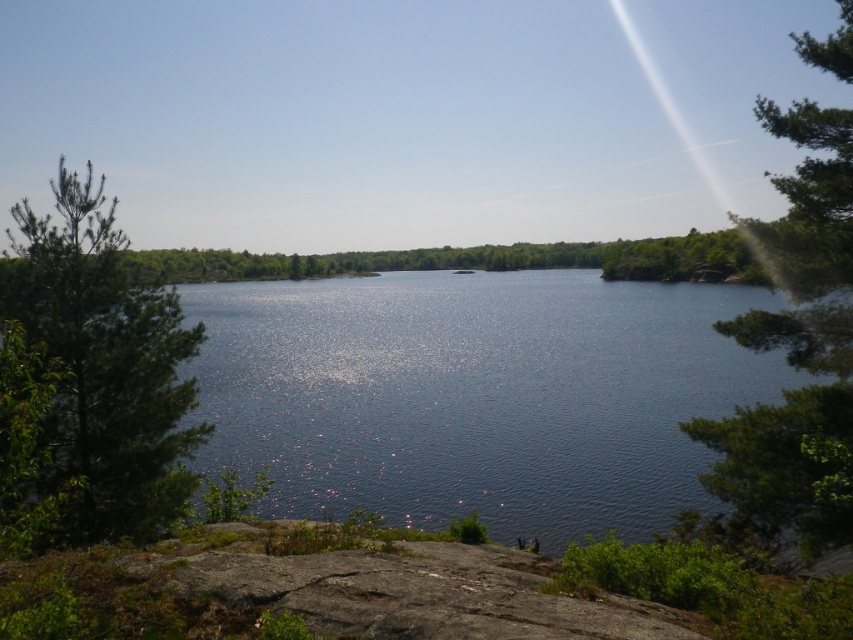
Question: Which object is closer to the camera taking this photo?

Choices:
 (A) green leafy tree at right
 (B) green needle-like at left

Answer: (B)

Question: Which point is farther from the camera taking this photo?

Choices:
 (A) (431, 416)
 (B) (807, 188)

Answer: (A)

Question: Which of the following is the farthest from the observer?

Choices:
 (A) (305, 371)
 (B) (143, 461)
 (C) (782, 413)

Answer: (A)

Question: Is shiny blue water at center wider than green leafy tree at right?

Choices:
 (A) yes
 (B) no

Answer: (B)

Question: Is green needle-like at left wider than green leafy tree at right?

Choices:
 (A) no
 (B) yes

Answer: (A)

Question: Can you confirm if shiny blue water at center is positioned above green leafy tree at right?

Choices:
 (A) no
 (B) yes

Answer: (A)